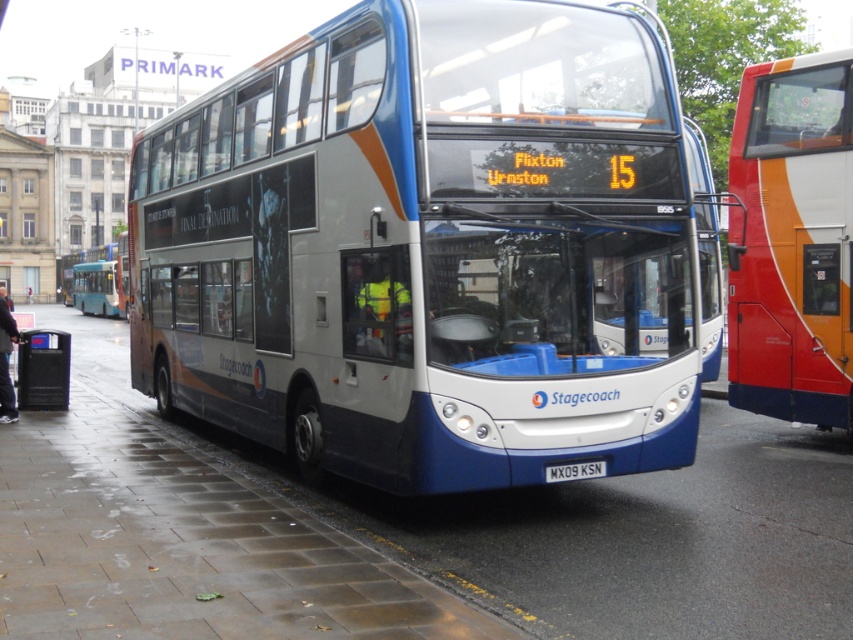
Does blue metallic bus at center have a larger size compared to black plastic license plate at center?

Incorrect, blue metallic bus at center is not larger than black plastic license plate at center.

Between point (233, 292) and point (595, 465), which one is positioned in front?

Point (595, 465) is in front.

Who is more distant from viewer, (672,467) or (590,467)?

Answer: The point (672,467) is behind.

Locate an element on the screen. blue metallic bus at center is located at coordinates (428, 248).

Can you confirm if black leather jacket at lower left is positioned above black plastic license plate at center?

Correct, black leather jacket at lower left is located above black plastic license plate at center.

Is black leather jacket at lower left bigger than black plastic license plate at center?

Yes.

Is point (0, 412) farther from viewer compared to point (602, 468)?

Yes.

Identify the location of black leather jacket at lower left. (6, 362).

Is wet concrete pavement at lower center wider than black leather jacket at lower left?

Incorrect, wet concrete pavement at lower center's width does not surpass black leather jacket at lower left's.

Is point (96, 355) closer to viewer compared to point (15, 337)?

That is False.

You are a GUI agent. You are given a task and a screenshot of the screen. Output one action in this format:
    pyautogui.click(x=<x>, y=<y>)
    Task: Click on the wet concrete pavement at lower center
    The image size is (853, 640).
    Given the screenshot: What is the action you would take?
    pyautogui.click(x=590, y=524)